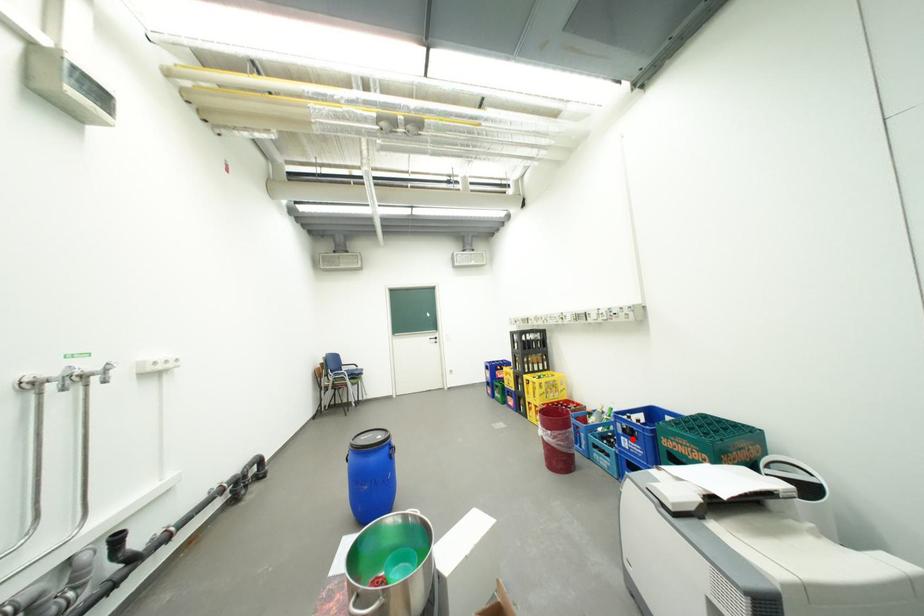
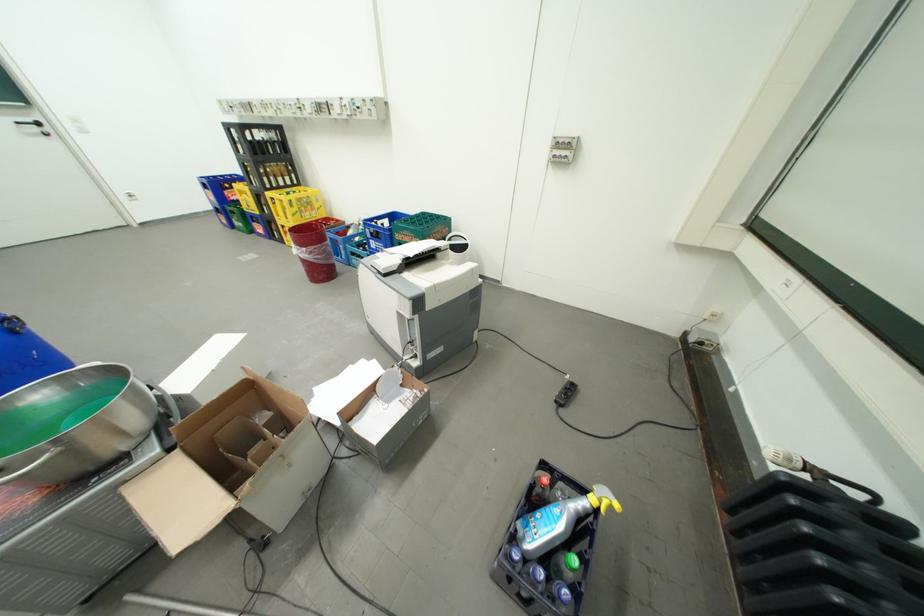
The point at the highlighted location is marked in the first image. Where is the corresponding point in the second image?

(381, 241)